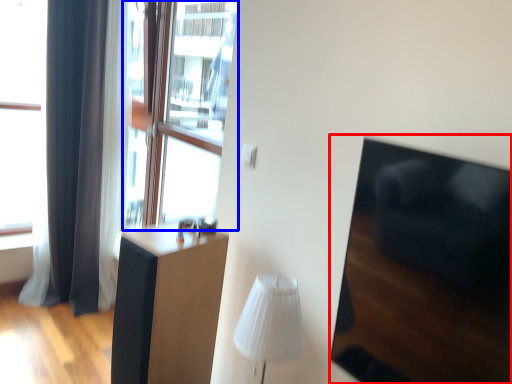
Question: Which object is further to the camera taking this photo, armchair (highlighted by a red box) or window screen (highlighted by a blue box)?

Choices:
 (A) armchair
 (B) window screen

Answer: (B)